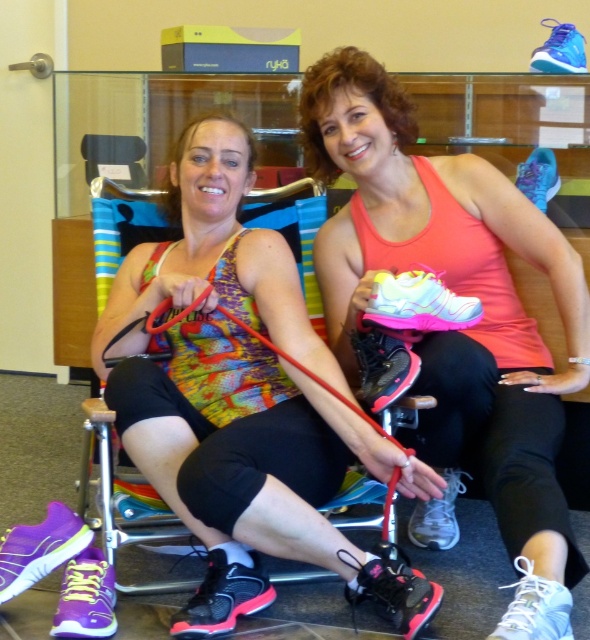
You are a fashion designer observing the scene. You need to place a new accessory between the multicolored fabric tank top at center and the pink matte shoe at center. Based on their positions, which object should the accessory be closer to?

The multicolored fabric tank top at center is positioned on the left side of pink matte shoe at center. Therefore, the accessory should be placed closer to the pink matte shoe at center to maintain symmetry between the two objects.